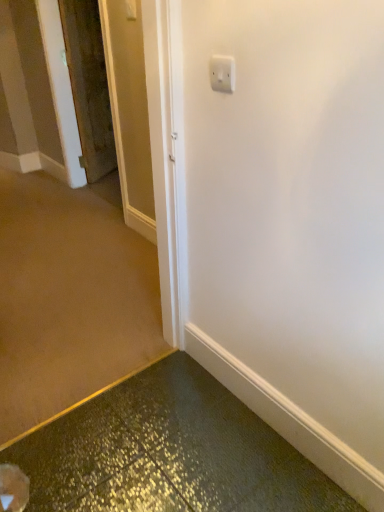
Question: Considering the relative sizes of white plastic light switch at upper center and wooden door at left in the image provided, is white plastic light switch at upper center shorter than wooden door at left?

Choices:
 (A) yes
 (B) no

Answer: (A)

Question: Is white plastic light switch at upper center to the left of wooden door at left from the viewer's perspective?

Choices:
 (A) yes
 (B) no

Answer: (B)

Question: Can you confirm if white plastic light switch at upper center is thinner than wooden door at left?

Choices:
 (A) no
 (B) yes

Answer: (B)

Question: Considering the relative sizes of white plastic light switch at upper center and wooden door at left in the image provided, is white plastic light switch at upper center taller than wooden door at left?

Choices:
 (A) no
 (B) yes

Answer: (A)

Question: Is the position of white plastic light switch at upper center more distant than that of wooden door at left?

Choices:
 (A) yes
 (B) no

Answer: (B)

Question: Is wooden door at left located within white plastic light switch at upper center?

Choices:
 (A) no
 (B) yes

Answer: (A)

Question: Is wooden door at left positioned with its back to white plastic light switch at upper center?

Choices:
 (A) yes
 (B) no

Answer: (B)

Question: Is wooden door at left thinner than white plastic light switch at upper center?

Choices:
 (A) no
 (B) yes

Answer: (A)

Question: Is the depth of wooden door at left greater than that of white plastic light switch at upper center?

Choices:
 (A) no
 (B) yes

Answer: (B)

Question: Could you tell me if wooden door at left is facing white plastic light switch at upper center?

Choices:
 (A) no
 (B) yes

Answer: (A)

Question: Considering the relative sizes of wooden door at left and white plastic light switch at upper center in the image provided, is wooden door at left bigger than white plastic light switch at upper center?

Choices:
 (A) yes
 (B) no

Answer: (A)

Question: Is wooden door at left positioned far away from white plastic light switch at upper center?

Choices:
 (A) no
 (B) yes

Answer: (B)

Question: In terms of width, does wooden door at left look wider or thinner when compared to white plastic light switch at upper center?

Choices:
 (A) thin
 (B) wide

Answer: (B)